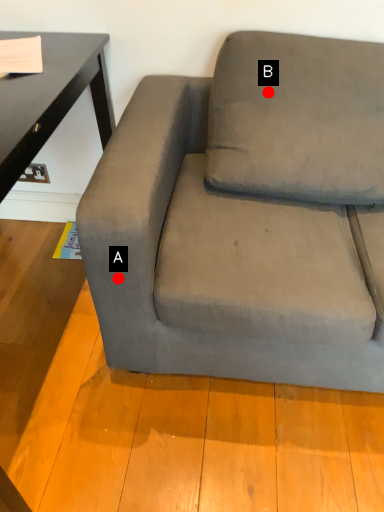
Question: Two points are circled on the image, labeled by A and B beside each circle. Which point is closer to the camera taking this photo?

Choices:
 (A) A is closer
 (B) B is closer

Answer: (A)